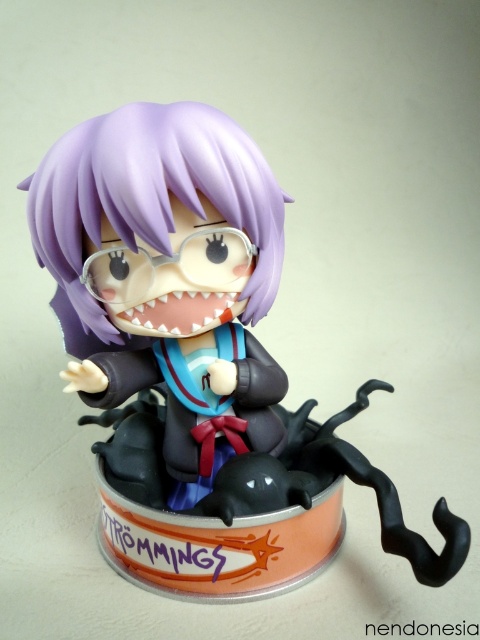
Question: Which object is farther from the camera taking this photo?

Choices:
 (A) matte purple figure at center
 (B) purple matte hair at center

Answer: (A)

Question: Can you confirm if matte purple figure at center is smaller than purple matte hair at center?

Choices:
 (A) no
 (B) yes

Answer: (A)

Question: Does matte purple figure at center have a lesser width compared to purple matte hair at center?

Choices:
 (A) no
 (B) yes

Answer: (A)

Question: Which of the following is the closest to the observer?

Choices:
 (A) (129, 161)
 (B) (115, 472)

Answer: (A)

Question: Does matte purple figure at center have a lesser width compared to purple matte hair at center?

Choices:
 (A) yes
 (B) no

Answer: (B)